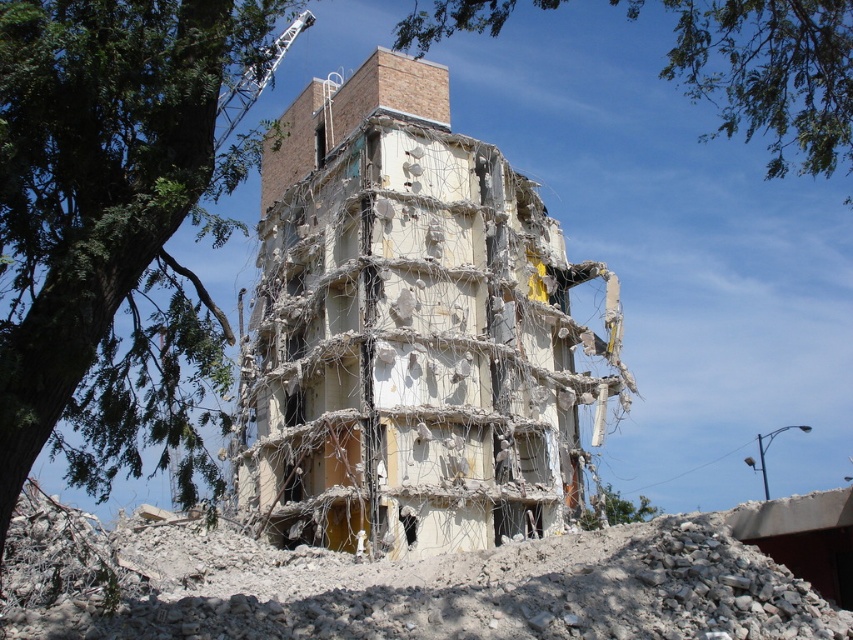
In the scene shown: You are a drone operator trying to capture aerial footage of a demolition site. Your drone is currently hovering at the camera position. You need to fly the drone to a point that is closer to the camera. Which point should you choose between point [135,125] and point [770,1]?

Point [135,125] is closer to the camera than point [770,1], so you should choose point [135,125].

You are an architect inspecting the demolition site. You notice two green leafy trees in the upper part of the image. Which tree is closer to you, the green leafy tree at upper left or the green leafy tree at upper center?

The green leafy tree at upper left is closer to you because it is in front of the green leafy tree at upper center.

You are a drone operator tasked with capturing aerial footage of the partially demolished building. The green leafy tree at upper left is located at coordinates point 0.345, 0.136. To ensure safety, you must keep the drone at least 10 meters away from the tree. What is the minimum safe distance the drone should maintain from the tree?

The minimum safe distance the drone should maintain from the green leafy tree at upper left is 10 meters as specified.